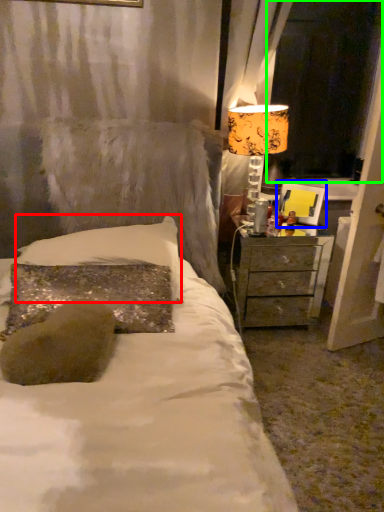
Question: Which object is the closest to the pillow (highlighted by a red box)? Choose among these: picture frame (highlighted by a blue box) or window screen (highlighted by a green box).

Choices:
 (A) picture frame
 (B) window screen

Answer: (A)